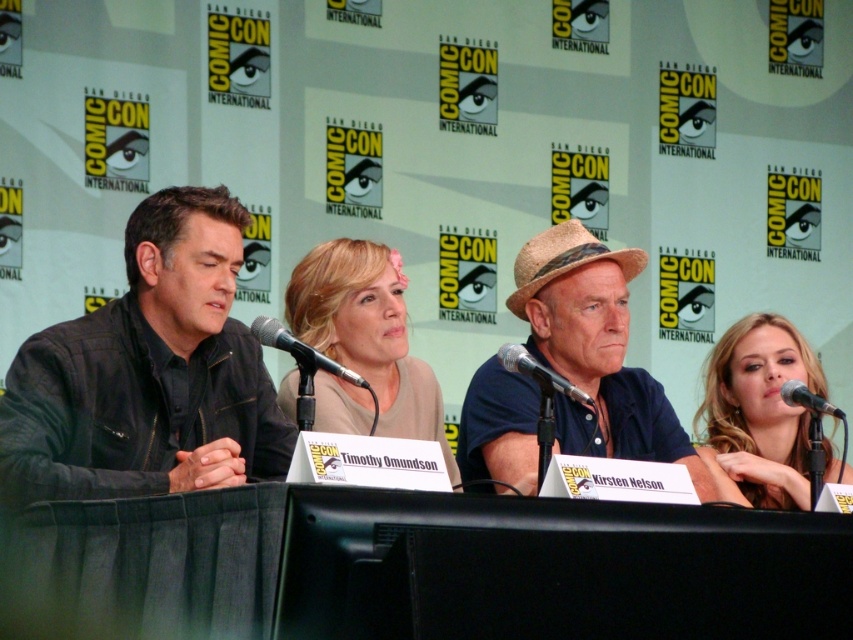
Which is more to the right, blue denim shirt at center or black metallic microphone at lower right?

Positioned to the right is black metallic microphone at lower right.

Between point (695, 483) and point (820, 410), which one is positioned behind?

The point (695, 483) is more distant.

Identify the location of blue denim shirt at center. Image resolution: width=853 pixels, height=640 pixels. (596, 349).

Between black metallic microphone at center and metallic silver microphone at center, which one has more height?

Standing taller between the two is black metallic microphone at center.

Describe the element at coordinates (300, 349) in the screenshot. I see `black metallic microphone at center` at that location.

At what (x,y) coordinates should I click in order to perform the action: click on black metallic microphone at center. Please return your answer as a coordinate pair (x, y). The image size is (853, 640). Looking at the image, I should click on (300, 349).

Is point (613, 388) positioned behind point (379, 243)?

No, (613, 388) is in front of (379, 243).

Consider the image. Which is above, blue denim shirt at center or blonde hair at center?

blue denim shirt at center is above.

Where is `blue denim shirt at center`? The width and height of the screenshot is (853, 640). blue denim shirt at center is located at coordinates (596, 349).

Locate an element on the screen. blue denim shirt at center is located at coordinates (596, 349).